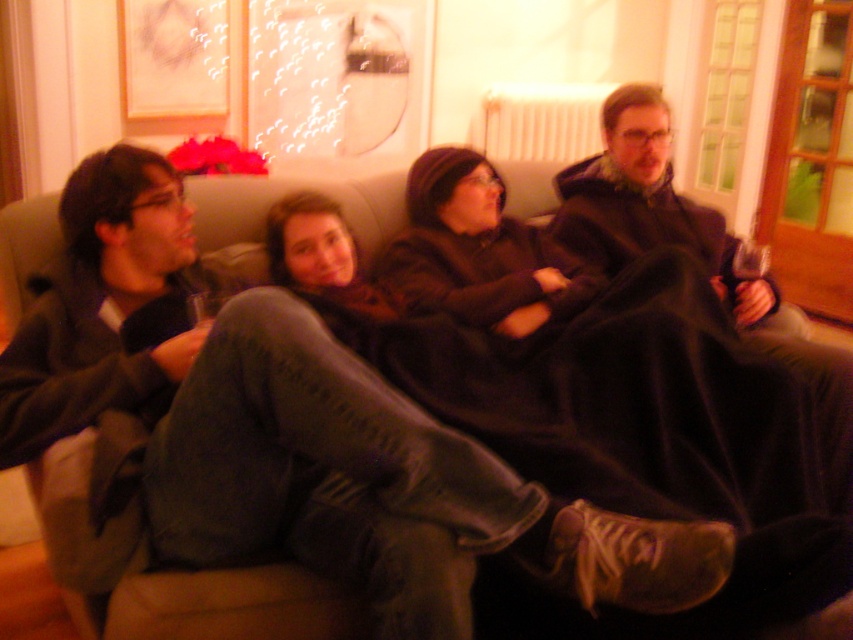
You are planning to place a small decorative item on the sofa where the dark gray hoodie at center is currently located. What are the coordinates of the spot where the hoodie is positioned?

The dark gray hoodie at center is located at point [126,365], so you should place the decorative item at those coordinates.

You are standing in front of the sofa where four people are sitting. There are two points marked on the sofa. One at point coordinates (602, 524) and the other at (692, 253). Which point is closer to you?

Point (602, 524) is closer to you because it is closer to the camera than point (692, 253).

Consider the image. You are a photographer setting up for a group photo. You need to ensure that the dark gray hoodie at center and the dark brown fleece blanket at right are both visible in the frame. Based on their positions, which object should you focus on first to ensure both are in focus?

The dark gray hoodie at center is closer to the viewer than the dark brown fleece blanket at right. To ensure both are in focus, focus on the dark gray hoodie at center first since it is closer, and the blanket will fall within the depth of field if properly adjusted.